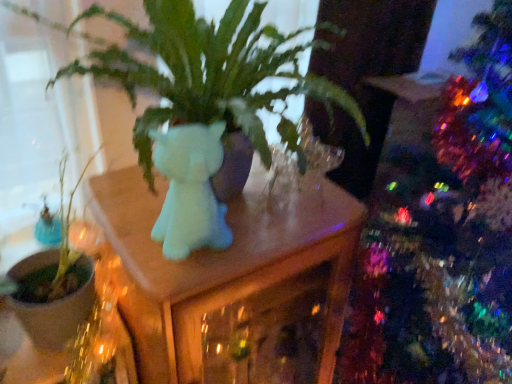
Question: Could green matte plant at left be considered to be inside matte white unicorn at center?

Choices:
 (A) yes
 (B) no

Answer: (B)

Question: Does matte white unicorn at center come in front of green matte plant at left?

Choices:
 (A) no
 (B) yes

Answer: (B)

Question: Could you tell me if matte white unicorn at center is turned towards green matte plant at left?

Choices:
 (A) no
 (B) yes

Answer: (A)

Question: Does matte white unicorn at center have a greater height compared to green matte plant at left?

Choices:
 (A) no
 (B) yes

Answer: (B)

Question: Is matte white unicorn at center outside of green matte plant at left?

Choices:
 (A) no
 (B) yes

Answer: (B)

Question: From the image's perspective, is matte white unicorn at center positioned above or below matte white cat at center?

Choices:
 (A) above
 (B) below

Answer: (B)

Question: Considering the positions of matte white unicorn at center and matte white cat at center in the image, is matte white unicorn at center taller or shorter than matte white cat at center?

Choices:
 (A) tall
 (B) short

Answer: (A)

Question: Considering the positions of point (324, 274) and point (165, 233), is point (324, 274) closer or farther from the camera than point (165, 233)?

Choices:
 (A) closer
 (B) farther

Answer: (B)

Question: Looking at their shapes, would you say matte white unicorn at center is wider or thinner than matte white cat at center?

Choices:
 (A) thin
 (B) wide

Answer: (B)

Question: Considering the positions of point (182, 167) and point (296, 253), is point (182, 167) closer or farther from the camera than point (296, 253)?

Choices:
 (A) closer
 (B) farther

Answer: (A)

Question: Is matte white cat at center taller or shorter than matte white unicorn at center?

Choices:
 (A) tall
 (B) short

Answer: (B)

Question: In the image, is matte white cat at center positioned in front of or behind matte white unicorn at center?

Choices:
 (A) behind
 (B) front

Answer: (B)

Question: Is matte white cat at center inside or outside of matte white unicorn at center?

Choices:
 (A) inside
 (B) outside

Answer: (B)

Question: From a real-world perspective, is matte white cat at center above or below green matte plant at left?

Choices:
 (A) below
 (B) above

Answer: (B)

Question: Do you think matte white cat at center is within green matte plant at left, or outside of it?

Choices:
 (A) outside
 (B) inside

Answer: (A)